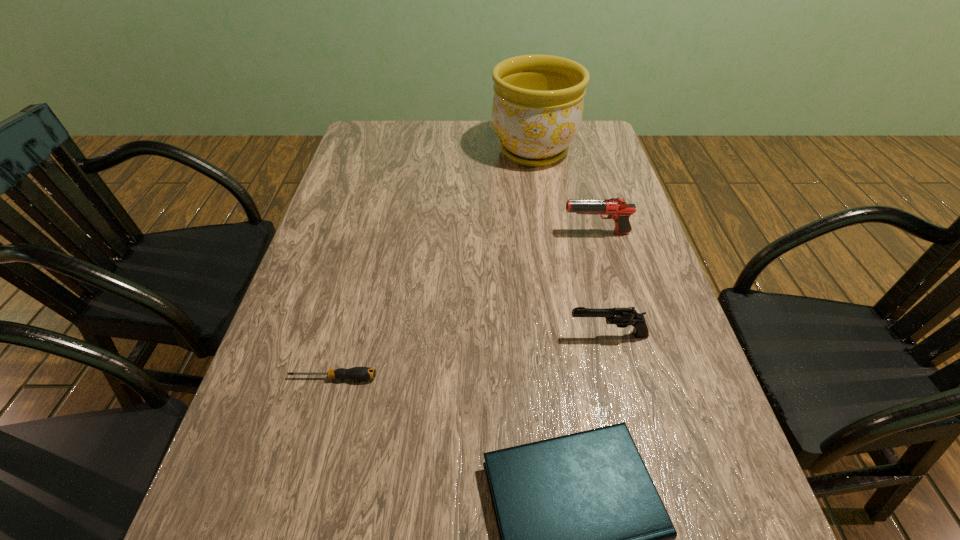
At what (x,y) coordinates should I click in order to perform the action: click on free space at the far edge. Please return your answer as a coordinate pair (x, y). The width and height of the screenshot is (960, 540). Looking at the image, I should click on (495, 152).

This screenshot has width=960, height=540. Find the location of `vacant area at the left edge of the desktop`. vacant area at the left edge of the desktop is located at coordinates (282, 368).

The image size is (960, 540). I want to click on free point at the right edge, so click(639, 245).

I want to click on vacant space at the far left corner of the desktop, so click(x=399, y=142).

I want to click on vacant space at the far right corner of the desktop, so click(587, 138).

Image resolution: width=960 pixels, height=540 pixels. Find the location of `empty location between the farthest object and the farther gun`. empty location between the farthest object and the farther gun is located at coordinates (564, 192).

This screenshot has height=540, width=960. I want to click on blank region between the taller gun and the tallest object, so click(x=564, y=192).

Locate an element on the screen. vacant space that's between the shortest object and the tallest object is located at coordinates (433, 265).

Where is `vacant point located between the third shortest object and the screwdriver`? vacant point located between the third shortest object and the screwdriver is located at coordinates (470, 356).

At what (x,y) coordinates should I click in order to perform the action: click on vacant area between the farther gun and the fourth farthest object. Please return your answer as a coordinate pair (x, y). Image resolution: width=960 pixels, height=540 pixels. Looking at the image, I should click on (465, 305).